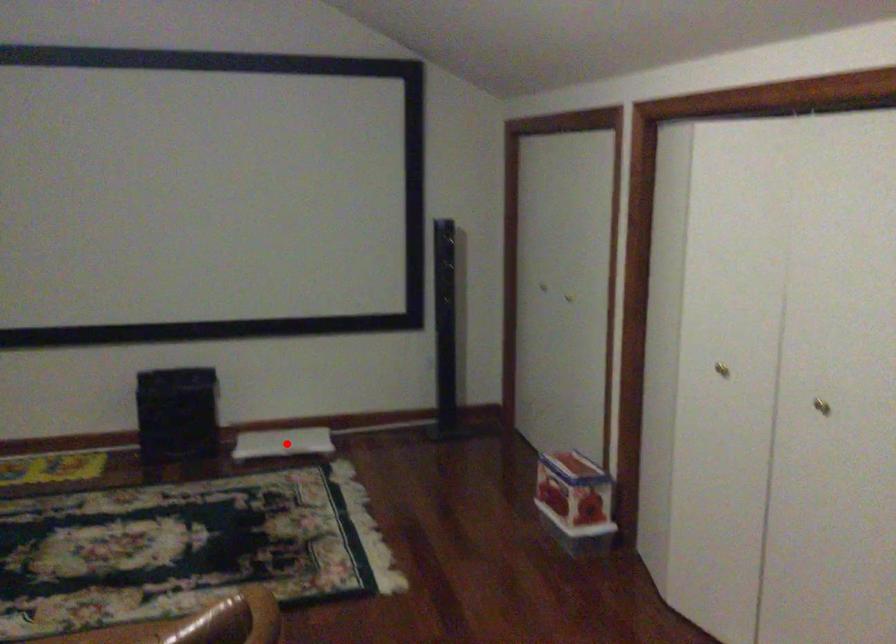
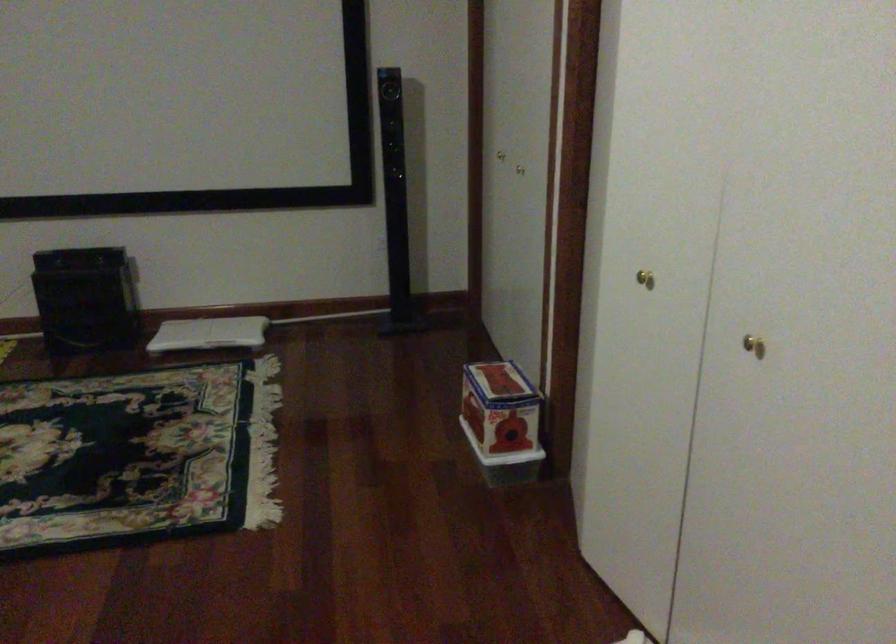
Question: I am providing you with two images of the same scene from different viewpoints. Image1 has a red point marked. In image2, the corresponding 3D location appears at what relative position? Reply with the corresponding letter.

Choices:
 (A) Closer
 (B) Farther

Answer: (A)